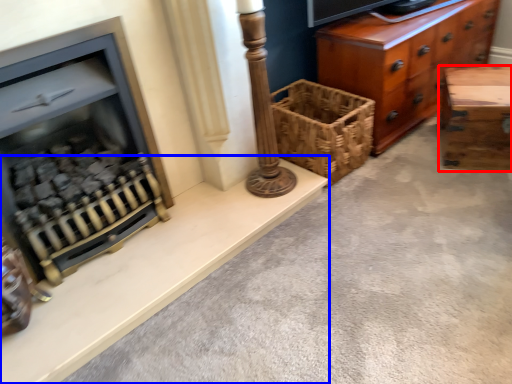
Question: Which object is closer to the camera taking this photo, table (highlighted by a red box) or ledge (highlighted by a blue box)?

Choices:
 (A) table
 (B) ledge

Answer: (B)